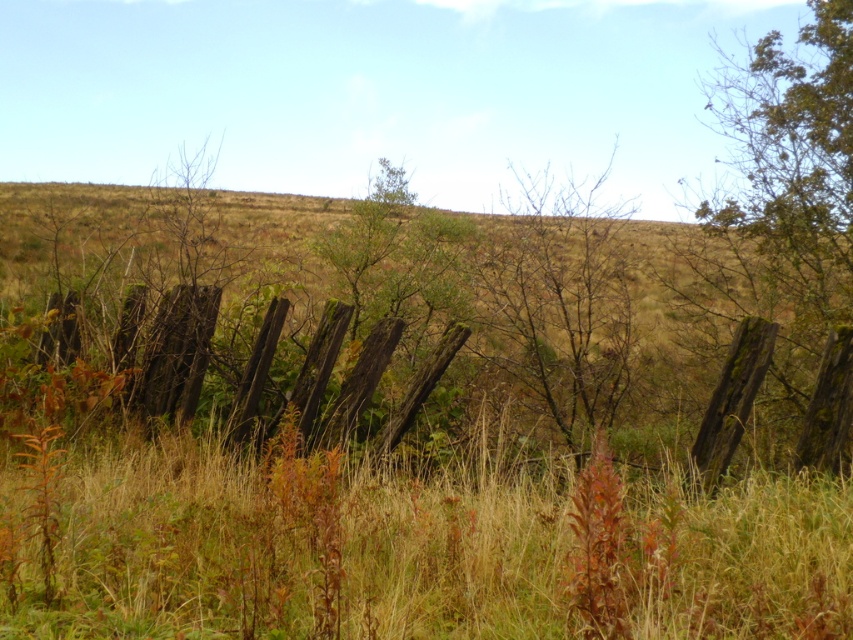
Question: In this image, where is green mossy fence post at right located relative to bare branches at center?

Choices:
 (A) right
 (B) left

Answer: (A)

Question: Estimate the real-world distances between objects in this image. Which object is farther from the green mossy fence post at right?

Choices:
 (A) bare branches at center
 (B) weathered wood fence at center

Answer: (B)

Question: Which is nearer to the weathered wood fence at center?

Choices:
 (A) bare branches at center
 (B) green mossy fence post at right

Answer: (A)

Question: Which of these objects is positioned farthest from the green mossy fence post at right?

Choices:
 (A) weathered wood fence at center
 (B) bare branches at center

Answer: (A)

Question: Does green mossy fence post at right have a lesser width compared to bare branches at center?

Choices:
 (A) no
 (B) yes

Answer: (A)

Question: Is weathered wood fence at center to the right of bare branches at center from the viewer's perspective?

Choices:
 (A) yes
 (B) no

Answer: (B)